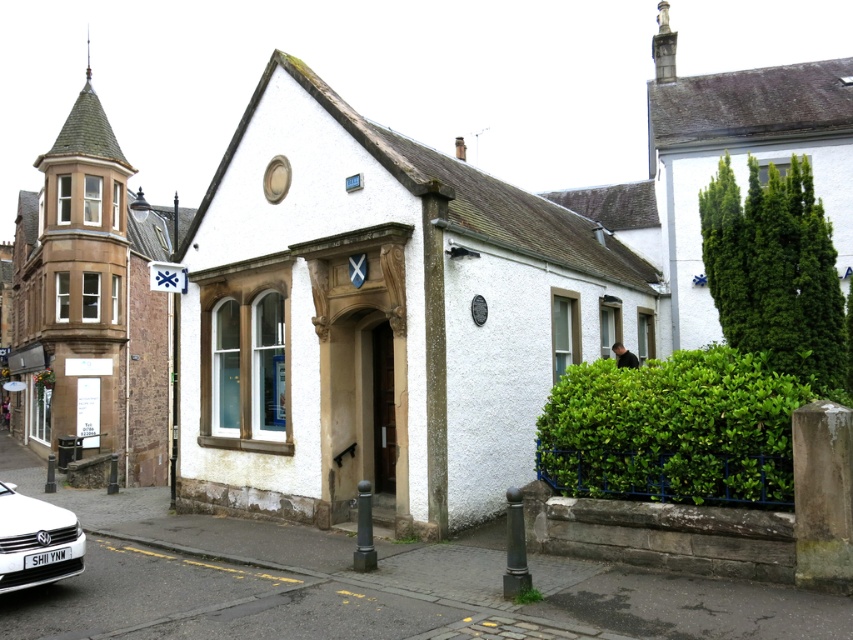
Is green leafy bush at right shorter than white matte car at lower left?

In fact, green leafy bush at right may be taller than white matte car at lower left.

Between green leafy bush at right and white matte car at lower left, which one appears on the right side from the viewer's perspective?

green leafy bush at right

Between point (695, 356) and point (20, 584), which one is positioned in front?

Positioned in front is point (20, 584).

Locate an element on the screen. green leafy bush at right is located at coordinates (672, 429).